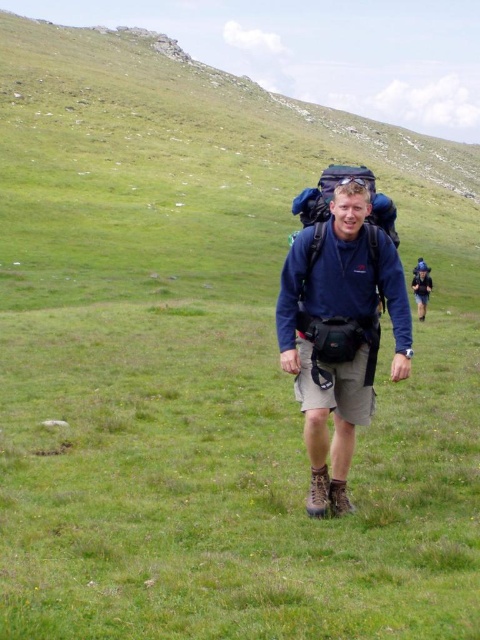
You are a photographer trying to capture the hiker in the image. Since both the matte blue shirt at center and the matte blue backpack at center are blue, how can you distinguish which one is taller in your photo?

The matte blue shirt at center is much taller than the matte blue backpack at center, so in the photo, the matte blue shirt at center will appear taller than the matte blue backpack at center.

You are a photographer trying to capture the hiker in the grassy field. You want to ensure both the matte blue shirt at center and the matte blue backpack at center are clearly visible in your shot. Based on their sizes, which object should you focus on to ensure both are in frame?

The matte blue shirt at center might be wider than the matte blue backpack at center, so focusing on the shirt would help ensure both are in frame as the shirt is likely larger and central.

You are a hiker preparing to adjust your gear. You have a matte blue shirt at center and a matte blue backpack at center. Which item is positioned lower on your body?

The matte blue shirt at center is below the matte blue backpack at center, so the matte blue shirt at center is positioned lower on the body.